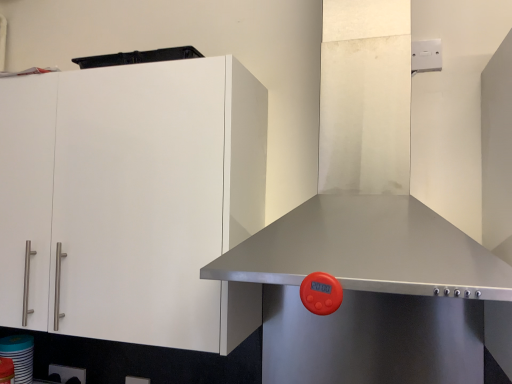
Question: From a real-world perspective, is stainless steel exhaust hood at center on white glossy cup at lower left?

Choices:
 (A) yes
 (B) no

Answer: (A)

Question: Does stainless steel exhaust hood at center have a greater width compared to white glossy cup at lower left?

Choices:
 (A) no
 (B) yes

Answer: (B)

Question: Is stainless steel exhaust hood at center positioned before white glossy cup at lower left?

Choices:
 (A) no
 (B) yes

Answer: (B)

Question: Is stainless steel exhaust hood at center facing away from white glossy cup at lower left?

Choices:
 (A) no
 (B) yes

Answer: (A)

Question: Can you confirm if stainless steel exhaust hood at center is thinner than white glossy cup at lower left?

Choices:
 (A) yes
 (B) no

Answer: (B)

Question: Can you confirm if stainless steel exhaust hood at center is positioned to the left of white glossy cup at lower left?

Choices:
 (A) yes
 (B) no

Answer: (B)

Question: Is white glossy cup at lower left positioned far away from stainless steel exhaust hood at center?

Choices:
 (A) no
 (B) yes

Answer: (B)

Question: From a real-world perspective, is white glossy cup at lower left on stainless steel exhaust hood at center?

Choices:
 (A) yes
 (B) no

Answer: (B)

Question: Is white glossy cup at lower left at the right side of stainless steel exhaust hood at center?

Choices:
 (A) no
 (B) yes

Answer: (A)

Question: Is white glossy cup at lower left closer to camera compared to stainless steel exhaust hood at center?

Choices:
 (A) yes
 (B) no

Answer: (B)

Question: Could you tell me if white glossy cup at lower left is turned towards stainless steel exhaust hood at center?

Choices:
 (A) yes
 (B) no

Answer: (B)

Question: Is white glossy cup at lower left oriented away from stainless steel exhaust hood at center?

Choices:
 (A) no
 (B) yes

Answer: (A)

Question: Is stainless steel exhaust hood at center facing towards white matte cabinet at left?

Choices:
 (A) yes
 (B) no

Answer: (B)